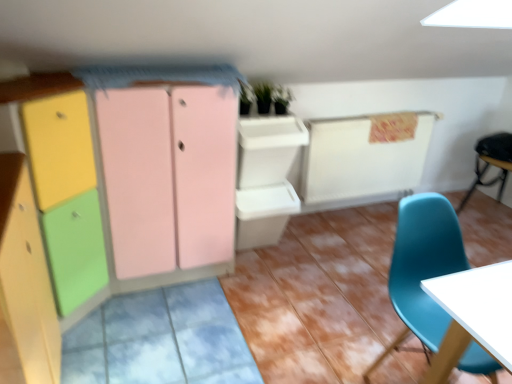
Where is `empty space that is to the right of matte pink cabinet at center, which is the third cabinetry from front to back`? empty space that is to the right of matte pink cabinet at center, which is the third cabinetry from front to back is located at coordinates (278, 286).